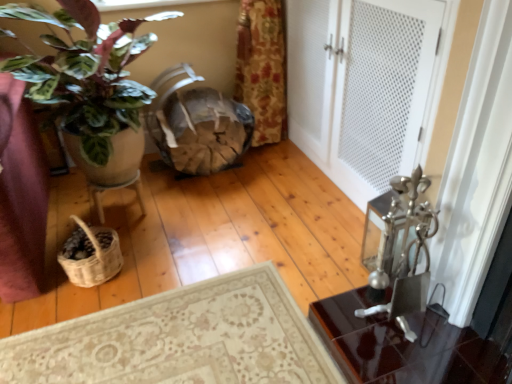
Measure the distance between woven natural fiber basket at lower left and camera.

woven natural fiber basket at lower left is 4.86 feet away from camera.

Measure the distance between point (426, 21) and camera.

The depth of point (426, 21) is 4.28 feet.

Locate an element on the screen. wooden textured basket at center is located at coordinates (197, 125).

How different are the orientations of wooden textured basket at center and white textured door at center in degrees?

87.1 degrees separate the facing orientations of wooden textured basket at center and white textured door at center.

Does wooden textured basket at center have a greater height compared to white textured door at center?

In fact, wooden textured basket at center may be shorter than white textured door at center.

Is wooden textured basket at center turned away from white textured door at center?

No, wooden textured basket at center's orientation is not away from white textured door at center.

Who is more distant, wooden textured basket at center or white textured door at center?

wooden textured basket at center is further from the camera.

In the image, is wooden textured basket at center on the left side or the right side of woven natural fiber basket at lower left?

wooden textured basket at center is to the right of woven natural fiber basket at lower left.

Who is smaller, wooden textured basket at center or woven natural fiber basket at lower left?

With smaller size is woven natural fiber basket at lower left.

Would you say wooden textured basket at center is a long distance from woven natural fiber basket at lower left?

No.

From a real-world perspective, is wooden textured basket at center above or below woven natural fiber basket at lower left?

From a real-world perspective, wooden textured basket at center is physically above woven natural fiber basket at lower left.

From their relative heights in the image, would you say matte brown pot at left is taller or shorter than white textured door at center?

In the image, matte brown pot at left appears to be shorter than white textured door at center.

Find the location of a particular element. Image resolution: width=512 pixels, height=384 pixels. door that is behind the matte brown pot at left is located at coordinates (361, 86).

Would you say matte brown pot at left is inside or outside white textured door at center?

matte brown pot at left is located beyond the bounds of white textured door at center.

From a real-world perspective, is matte brown pot at left below white textured door at center?

Incorrect, from a real-world perspective, matte brown pot at left is higher than white textured door at center.

Does woven natural fiber basket at lower left appear on the left side of wooden textured basket at center?

Indeed, woven natural fiber basket at lower left is positioned on the left side of wooden textured basket at center.

Considering the positions of point (63, 265) and point (213, 153), is point (63, 265) closer or farther from the camera than point (213, 153)?

Point (63, 265) is positioned closer to the camera compared to point (213, 153).

In the scene shown: Is wooden textured basket at center located within woven natural fiber basket at lower left?

No, woven natural fiber basket at lower left does not contain wooden textured basket at center.

The height and width of the screenshot is (384, 512). Identify the location of houseplant in front of the woven natural fiber basket at lower left. (86, 74).

Does matte brown pot at left have a smaller size compared to woven natural fiber basket at lower left?

Incorrect, matte brown pot at left is not smaller in size than woven natural fiber basket at lower left.

Considering the positions of point (99, 69) and point (86, 280), is point (99, 69) closer or farther from the camera than point (86, 280)?

Clearly, point (99, 69) is more distant from the camera than point (86, 280).

From a real-world perspective, does matte brown pot at left stand above woven natural fiber basket at lower left?

Indeed, from a real-world perspective, matte brown pot at left stands above woven natural fiber basket at lower left.

Would you say white textured door at center is a long distance from woven natural fiber basket at lower left?

Indeed, white textured door at center is not near woven natural fiber basket at lower left.

How much distance is there between white textured door at center and woven natural fiber basket at lower left?

1.13 meters.

Is white textured door at center oriented towards woven natural fiber basket at lower left?

Yes.

Based on the photo, considering the sizes of objects white textured door at center and woven natural fiber basket at lower left in the image provided, who is thinner, white textured door at center or woven natural fiber basket at lower left?

Thinner between the two is woven natural fiber basket at lower left.

From the image's perspective, which one is positioned lower, white textured door at center or wooden textured basket at center?

wooden textured basket at center.

Between white textured door at center and wooden textured basket at center, which one has more height?

Standing taller between the two is white textured door at center.

Based on the photo, is white textured door at center smaller than wooden textured basket at center?

Incorrect, white textured door at center is not smaller in size than wooden textured basket at center.

Is the position of white textured door at center more distant than that of wooden textured basket at center?

No.

The height and width of the screenshot is (384, 512). I want to click on rocking chair that is on the left side of white textured door at center, so click(197, 125).

I want to click on basket located below the wooden textured basket at center (from the image's perspective), so click(93, 259).

Looking at the image, which one is located further to white textured door at center, matte brown pot at left or woven natural fiber basket at lower left?

woven natural fiber basket at lower left is positioned further to the anchor white textured door at center.

Estimate the real-world distances between objects in this image. Which object is closer to matte brown pot at left, woven natural fiber basket at lower left or white textured door at center?

The object closer to matte brown pot at left is woven natural fiber basket at lower left.

From the image, which object appears to be nearer to white textured door at center, woven natural fiber basket at lower left or wooden textured basket at center?

The object closer to white textured door at center is wooden textured basket at center.

Estimate the real-world distances between objects in this image. Which object is further from woven natural fiber basket at lower left, white textured door at center or wooden textured basket at center?

white textured door at center is further to woven natural fiber basket at lower left.

Considering their positions, is white textured door at center positioned closer to matte brown pot at left than woven natural fiber basket at lower left?

Based on the image, woven natural fiber basket at lower left appears to be nearer to matte brown pot at left.

From the image, which object appears to be farther from matte brown pot at left, woven natural fiber basket at lower left or wooden textured basket at center?

Based on the image, wooden textured basket at center appears to be further to matte brown pot at left.

Looking at the image, which one is located closer to matte brown pot at left, wooden textured basket at center or woven natural fiber basket at lower left?

woven natural fiber basket at lower left.

When comparing their distances from wooden textured basket at center, does woven natural fiber basket at lower left or white textured door at center seem further?

woven natural fiber basket at lower left is positioned further to the anchor wooden textured basket at center.

This screenshot has width=512, height=384. In order to click on basket between matte brown pot at left and white textured door at center in the horizontal direction in this screenshot , I will do (x=93, y=259).

The width and height of the screenshot is (512, 384). What are the coordinates of `rocking chair situated between matte brown pot at left and white textured door at center from left to right` in the screenshot? It's located at (197, 125).

At what (x,y) coordinates should I click in order to perform the action: click on rocking chair between woven natural fiber basket at lower left and white textured door at center. Please return your answer as a coordinate pair (x, y). This screenshot has width=512, height=384. Looking at the image, I should click on (197, 125).

This screenshot has width=512, height=384. Identify the location of basket positioned between matte brown pot at left and wooden textured basket at center from near to far. (93, 259).